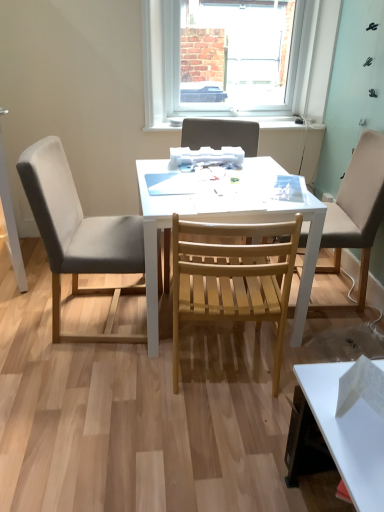
Question: Can you see wooden slatted chair at center, the first chair when ordered from right to left, touching white matte desk at center?

Choices:
 (A) no
 (B) yes

Answer: (A)

Question: Is wooden slatted chair at center, the first chair when ordered from right to left, facing towards white matte desk at center?

Choices:
 (A) yes
 (B) no

Answer: (A)

Question: Considering the relative sizes of wooden slatted chair at center, the first chair when ordered from right to left, and white matte desk at center in the image provided, is wooden slatted chair at center, the first chair when ordered from right to left, thinner than white matte desk at center?

Choices:
 (A) no
 (B) yes

Answer: (B)

Question: Can you confirm if wooden slatted chair at center, the first chair when ordered from right to left, is smaller than white matte desk at center?

Choices:
 (A) no
 (B) yes

Answer: (B)

Question: From the image's perspective, is wooden slatted chair at center, marked as the 4th chair in a left-to-right arrangement, below white matte desk at center?

Choices:
 (A) no
 (B) yes

Answer: (A)

Question: Looking at their shapes, would you say gray fabric chair at left, acting as the 4th chair starting from the right, is wider or thinner than white plastic window at upper center?

Choices:
 (A) wide
 (B) thin

Answer: (A)

Question: Is gray fabric chair at left, placed as the 1th chair when sorted from left to right, taller or shorter than white plastic window at upper center?

Choices:
 (A) short
 (B) tall

Answer: (B)

Question: Relative to white plastic window at upper center, is gray fabric chair at left, placed as the 1th chair when sorted from left to right, in front or behind?

Choices:
 (A) front
 (B) behind

Answer: (A)

Question: Considering the positions of point (89, 238) and point (158, 35), is point (89, 238) closer or farther from the camera than point (158, 35)?

Choices:
 (A) farther
 (B) closer

Answer: (B)

Question: Considering the positions of natural wood chair at center, which is counted as the 2th chair, starting from the right, and wooden slatted chair at center, the first chair when ordered from right to left, in the image, is natural wood chair at center, which is counted as the 2th chair, starting from the right, taller or shorter than wooden slatted chair at center, the first chair when ordered from right to left,?

Choices:
 (A) short
 (B) tall

Answer: (A)

Question: Is natural wood chair at center, which is the 3th chair from left to right, to the left or to the right of wooden slatted chair at center, marked as the 4th chair in a left-to-right arrangement, in the image?

Choices:
 (A) right
 (B) left

Answer: (B)

Question: Does point click(x=274, y=305) appear closer or farther from the camera than point click(x=337, y=249)?

Choices:
 (A) farther
 (B) closer

Answer: (B)

Question: From a real-world perspective, is natural wood chair at center, which is counted as the 2th chair, starting from the right, above or below wooden slatted chair at center, marked as the 4th chair in a left-to-right arrangement?

Choices:
 (A) below
 (B) above

Answer: (A)

Question: Is white plastic window at upper center situated inside gray fabric chair at left, acting as the 4th chair starting from the right, or outside?

Choices:
 (A) outside
 (B) inside

Answer: (A)

Question: In the image, is white plastic window at upper center positioned in front of or behind gray fabric chair at left, acting as the 4th chair starting from the right?

Choices:
 (A) front
 (B) behind

Answer: (B)